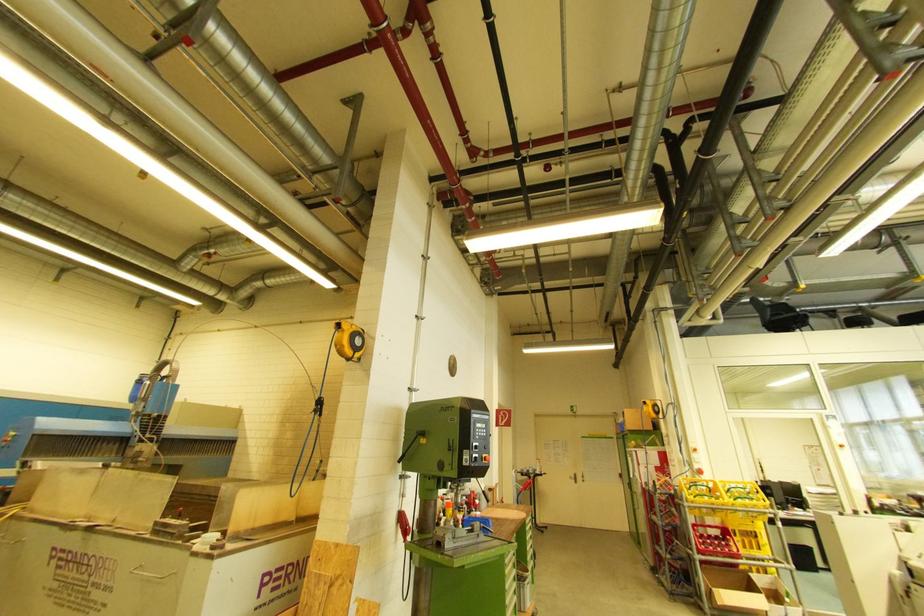
You are a GUI agent. You are given a task and a screenshot of the screen. Output one action in this format:
    pyautogui.click(x=<x>, y=<y>)
    Task: Click on the drill press handle
    
    Given the screenshot: What is the action you would take?
    pyautogui.click(x=410, y=445)